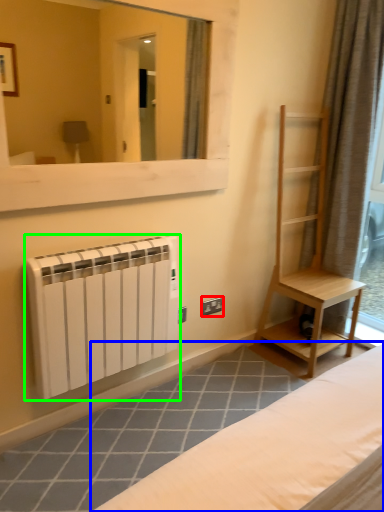
Question: Considering the real-world distances, which object is closest to electric outlet (highlighted by a red box)? furniture (highlighted by a blue box) or radiator (highlighted by a green box).

Choices:
 (A) furniture
 (B) radiator

Answer: (B)